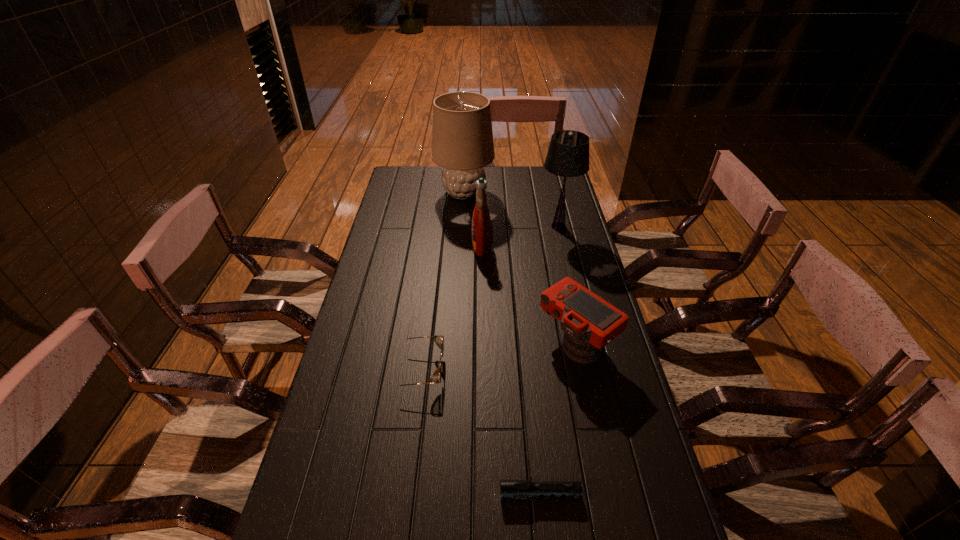
Where is `unoccupied position between the third shortest object and the third tallest object`? unoccupied position between the third shortest object and the third tallest object is located at coordinates (529, 294).

At what (x,y) coordinates should I click in order to perform the action: click on unoccupied position between the nearer lampshade and the farthest object. Please return your answer as a coordinate pair (x, y). Looking at the image, I should click on (512, 210).

In order to click on vacant area that lies between the right lampshade and the farther lampshade in this screenshot , I will do `click(512, 210)`.

Locate an element on the screen. The height and width of the screenshot is (540, 960). vacant space that's between the detergent and the nearest object is located at coordinates (511, 370).

Locate an element on the screen. This screenshot has width=960, height=540. the second closest object to the third tallest object is located at coordinates (568, 154).

In order to click on object that is the second closest to the camera in this screenshot , I will do `click(510, 489)`.